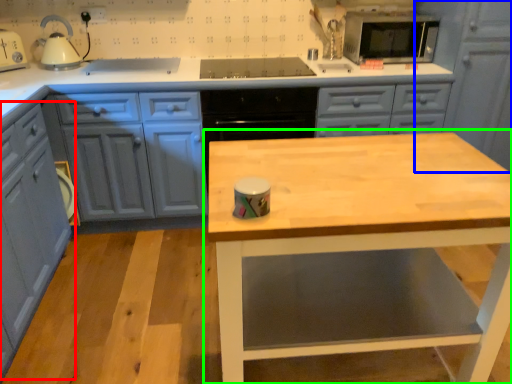
Question: Based on their relative distances, which object is farther from cabinetry (highlighted by a red box)? Choose from cabinetry (highlighted by a blue box) and table (highlighted by a green box).

Choices:
 (A) cabinetry
 (B) table

Answer: (A)